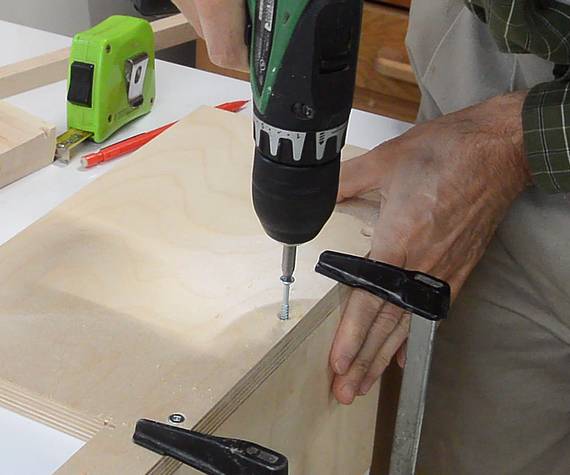
Find the location of `white table top`. white table top is located at coordinates (174, 87).